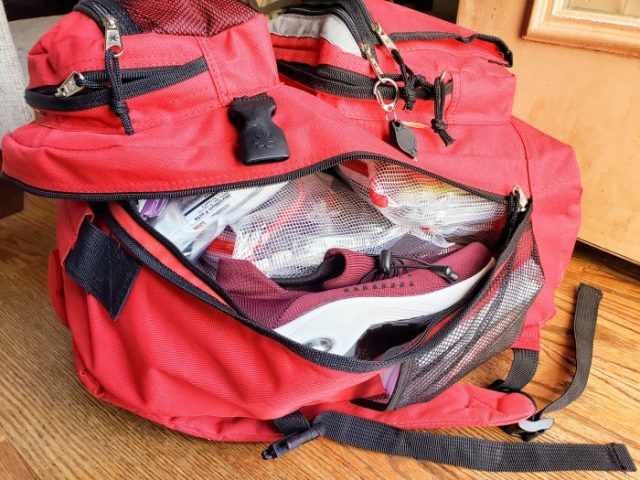
This screenshot has width=640, height=480. Identify the location of table. (29, 396).